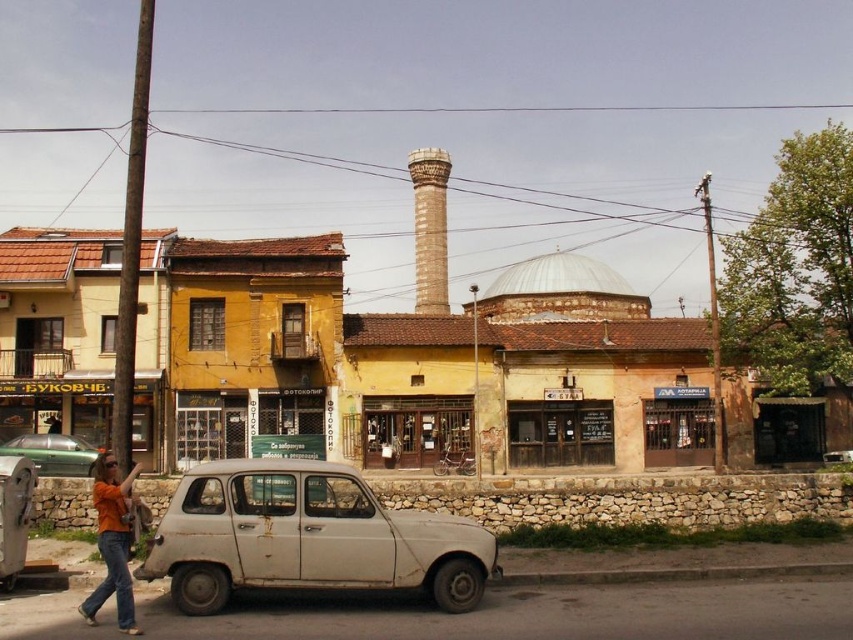
You are standing at the entrance of the street and want to park your car near the rusty white car at center. According to the coordinates provided, where exactly should you position your car?

The rusty white car at center is located at coordinates point (306, 538), so you should position your car near that point to park near it.

You are a photographer setting up equipment on the street. You notice an orange cotton shirt at lower left and a brown stone minaret at center. Which object is wider from your current viewpoint?

The orange cotton shirt at lower left is wider than the brown stone minaret at center.